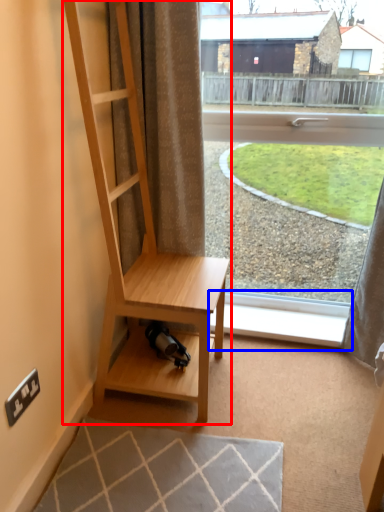
Question: Which point is closer to the camera, shelf (highlighted by a red box) or window sill (highlighted by a blue box)?

Choices:
 (A) shelf
 (B) window sill

Answer: (A)